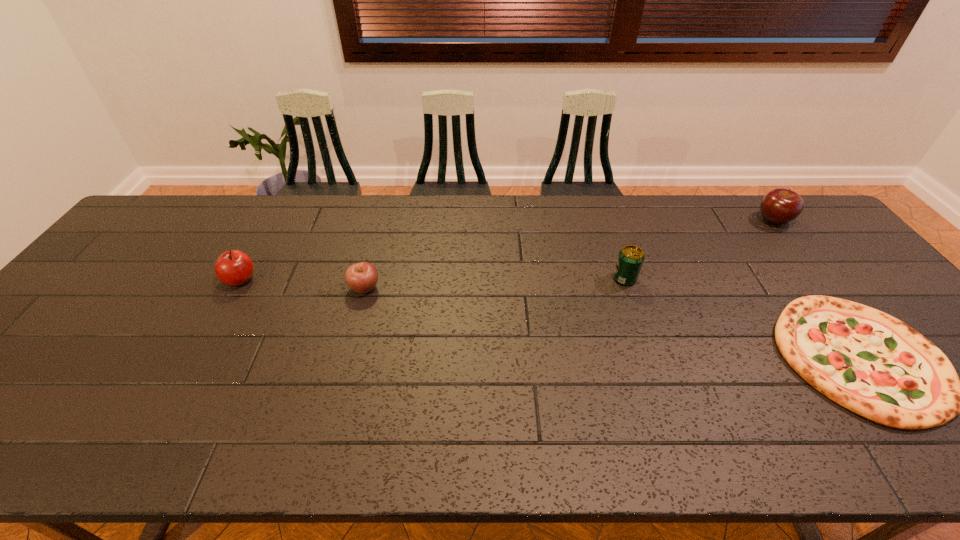
This screenshot has width=960, height=540. In order to click on object that is at the far edge in this screenshot , I will do (779, 206).

The width and height of the screenshot is (960, 540). What are the coordinates of `object at the right edge` in the screenshot? It's located at (779, 206).

Where is `object located in the far right corner section of the desktop`? object located in the far right corner section of the desktop is located at coordinates (779, 206).

Image resolution: width=960 pixels, height=540 pixels. I want to click on free spot at the far edge of the desktop, so click(452, 215).

This screenshot has height=540, width=960. In order to click on free space at the near edge of the desktop in this screenshot , I will do `click(287, 455)`.

At what (x,y) coordinates should I click in order to perform the action: click on vacant space at the left edge of the desktop. Please return your answer as a coordinate pair (x, y). The width and height of the screenshot is (960, 540). Looking at the image, I should click on (73, 366).

Locate an element on the screen. Image resolution: width=960 pixels, height=540 pixels. vacant space at the far left corner of the desktop is located at coordinates (201, 195).

Find the location of a particular element. This screenshot has width=960, height=540. free point between the second object from left to right and the farthest apple is located at coordinates (568, 254).

The height and width of the screenshot is (540, 960). Find the location of `free spot between the second object from left to right and the rightmost apple`. free spot between the second object from left to right and the rightmost apple is located at coordinates (568, 254).

Locate an element on the screen. The image size is (960, 540). free space between the third object from left to right and the fourth tallest object is located at coordinates (494, 284).